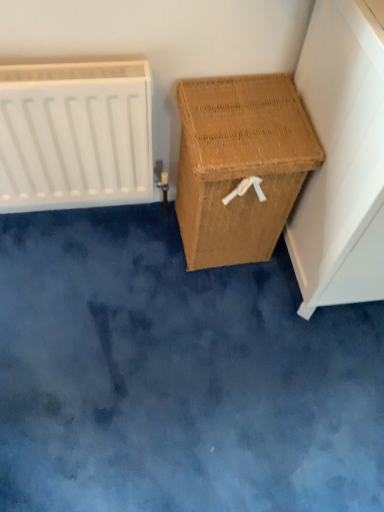
This screenshot has height=512, width=384. What are the coordinates of `woven brown laundry basket at right, which is the second furniture in left-to-right order` in the screenshot? It's located at (341, 159).

From a real-world perspective, is white matte radiator at left positioned under woven brown basket at right, which is counted as the first furniture, starting from the left, based on gravity?

No, from a real-world perspective, white matte radiator at left is not below woven brown basket at right, which is counted as the first furniture, starting from the left.

How far apart are white matte radiator at left and woven brown basket at right, which is counted as the first furniture, starting from the left?

The distance of white matte radiator at left from woven brown basket at right, which is counted as the first furniture, starting from the left, is 12.20 inches.

Looking at this image, in terms of height, does white matte radiator at left look taller or shorter compared to woven brown basket at right, which is counted as the first furniture, starting from the left?

white matte radiator at left is taller than woven brown basket at right, which is counted as the first furniture, starting from the left.

Considering the positions of points (38, 87) and (192, 146), is point (38, 87) closer to camera compared to point (192, 146)?

Yes, it is in front of point (192, 146).

Are woven brown laundry basket at right, which is the second furniture in left-to-right order, and white matte radiator at left beside each other?

No, woven brown laundry basket at right, which is the second furniture in left-to-right order, is not touching white matte radiator at left.

From a real-world perspective, who is located lower, woven brown laundry basket at right, the 1th furniture in the right-to-left sequence, or white matte radiator at left?

white matte radiator at left is physically lower.

Which object is thinner, woven brown laundry basket at right, which is the second furniture in left-to-right order, or white matte radiator at left?

white matte radiator at left is thinner.

Is woven brown laundry basket at right, the 1th furniture in the right-to-left sequence, inside the boundaries of woven brown basket at right, marked as the second furniture in a right-to-left arrangement, or outside?

woven brown laundry basket at right, the 1th furniture in the right-to-left sequence, is outside woven brown basket at right, marked as the second furniture in a right-to-left arrangement.

Considering the sizes of woven brown laundry basket at right, the 1th furniture in the right-to-left sequence, and woven brown basket at right, marked as the second furniture in a right-to-left arrangement, in the image, is woven brown laundry basket at right, the 1th furniture in the right-to-left sequence, taller or shorter than woven brown basket at right, marked as the second furniture in a right-to-left arrangement,?

In the image, woven brown laundry basket at right, the 1th furniture in the right-to-left sequence, appears to be taller than woven brown basket at right, marked as the second furniture in a right-to-left arrangement.

From a real-world perspective, is woven brown laundry basket at right, the 1th furniture in the right-to-left sequence, below woven brown basket at right, which is counted as the first furniture, starting from the left?

Actually, woven brown laundry basket at right, the 1th furniture in the right-to-left sequence, is physically above woven brown basket at right, which is counted as the first furniture, starting from the left, in the real world.

Does woven brown basket at right, which is counted as the first furniture, starting from the left, have a lesser width compared to white matte radiator at left?

No, woven brown basket at right, which is counted as the first furniture, starting from the left, is not thinner than white matte radiator at left.

Is woven brown basket at right, marked as the second furniture in a right-to-left arrangement, with white matte radiator at left?

No, woven brown basket at right, marked as the second furniture in a right-to-left arrangement, is not next to white matte radiator at left.

Does woven brown basket at right, which is counted as the first furniture, starting from the left, turn towards white matte radiator at left?

No.

From the picture: Who is more distant, woven brown basket at right, marked as the second furniture in a right-to-left arrangement, or white matte radiator at left?

woven brown basket at right, marked as the second furniture in a right-to-left arrangement, is behind.

Would you say woven brown laundry basket at right, the 1th furniture in the right-to-left sequence, is part of woven brown basket at right, marked as the second furniture in a right-to-left arrangement,'s contents?

No, woven brown laundry basket at right, the 1th furniture in the right-to-left sequence, is not inside woven brown basket at right, marked as the second furniture in a right-to-left arrangement.

Does point (272, 170) come closer to viewer compared to point (327, 230)?

Yes, point (272, 170) is in front of point (327, 230).

From a real-world perspective, is woven brown basket at right, marked as the second furniture in a right-to-left arrangement, physically above woven brown laundry basket at right, which is the second furniture in left-to-right order?

No, from a real-world perspective, woven brown basket at right, marked as the second furniture in a right-to-left arrangement, is not above woven brown laundry basket at right, which is the second furniture in left-to-right order.

Considering the relative positions of white matte radiator at left and woven brown laundry basket at right, the 1th furniture in the right-to-left sequence, in the image provided, is white matte radiator at left to the right of woven brown laundry basket at right, the 1th furniture in the right-to-left sequence, from the viewer's perspective?

Incorrect, white matte radiator at left is not on the right side of woven brown laundry basket at right, the 1th furniture in the right-to-left sequence.

Does white matte radiator at left touch woven brown laundry basket at right, the 1th furniture in the right-to-left sequence?

white matte radiator at left is not next to woven brown laundry basket at right, the 1th furniture in the right-to-left sequence, and they're not touching.

In terms of size, does white matte radiator at left appear bigger or smaller than woven brown laundry basket at right, the 1th furniture in the right-to-left sequence?

Considering their sizes, white matte radiator at left takes up less space than woven brown laundry basket at right, the 1th furniture in the right-to-left sequence.

From the image's perspective, is white matte radiator at left located above or below woven brown laundry basket at right, the 1th furniture in the right-to-left sequence?

Based on their image positions, white matte radiator at left is located above woven brown laundry basket at right, the 1th furniture in the right-to-left sequence.

I want to click on the 2nd furniture below the white matte radiator at left (from the image's perspective), so click(240, 165).

From the white matte radiator at left, count 2nd furniture to the right and point to it. Please provide its 2D coordinates.

[(341, 159)]

Considering their positions, is white matte radiator at left positioned closer to woven brown basket at right, marked as the second furniture in a right-to-left arrangement, than woven brown laundry basket at right, the 1th furniture in the right-to-left sequence?

The object closer to woven brown basket at right, marked as the second furniture in a right-to-left arrangement, is woven brown laundry basket at right, the 1th furniture in the right-to-left sequence.

Based on their spatial positions, is woven brown basket at right, marked as the second furniture in a right-to-left arrangement, or woven brown laundry basket at right, which is the second furniture in left-to-right order, further from white matte radiator at left?

Among the two, woven brown laundry basket at right, which is the second furniture in left-to-right order, is located further to white matte radiator at left.

Looking at the image, which one is located closer to woven brown laundry basket at right, the 1th furniture in the right-to-left sequence, woven brown basket at right, which is counted as the first furniture, starting from the left, or white matte radiator at left?

woven brown basket at right, which is counted as the first furniture, starting from the left, is closer to woven brown laundry basket at right, the 1th furniture in the right-to-left sequence.

Based on their spatial positions, is woven brown laundry basket at right, which is the second furniture in left-to-right order, or white matte radiator at left closer to woven brown basket at right, marked as the second furniture in a right-to-left arrangement?

woven brown laundry basket at right, which is the second furniture in left-to-right order, lies closer to woven brown basket at right, marked as the second furniture in a right-to-left arrangement, than the other object.

From the picture: Estimate the real-world distances between objects in this image. Which object is closer to woven brown laundry basket at right, the 1th furniture in the right-to-left sequence, white matte radiator at left or woven brown basket at right, which is counted as the first furniture, starting from the left?

woven brown basket at right, which is counted as the first furniture, starting from the left, is closer to woven brown laundry basket at right, the 1th furniture in the right-to-left sequence.

Considering their positions, is woven brown laundry basket at right, the 1th furniture in the right-to-left sequence, positioned further to white matte radiator at left than woven brown basket at right, marked as the second furniture in a right-to-left arrangement?

woven brown laundry basket at right, the 1th furniture in the right-to-left sequence.

The image size is (384, 512). Find the location of `furniture between white matte radiator at left and woven brown laundry basket at right, the 1th furniture in the right-to-left sequence, from left to right`. furniture between white matte radiator at left and woven brown laundry basket at right, the 1th furniture in the right-to-left sequence, from left to right is located at coordinates (240, 165).